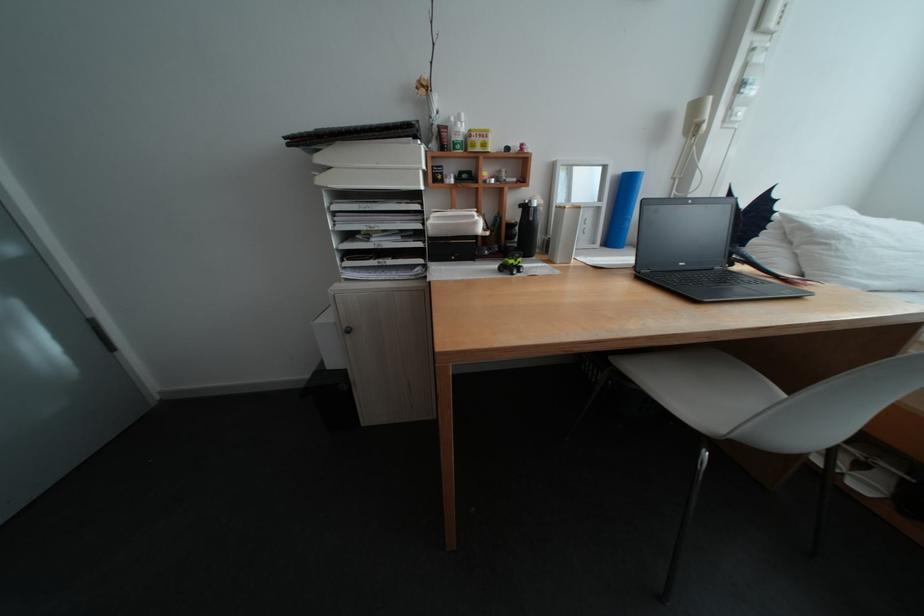
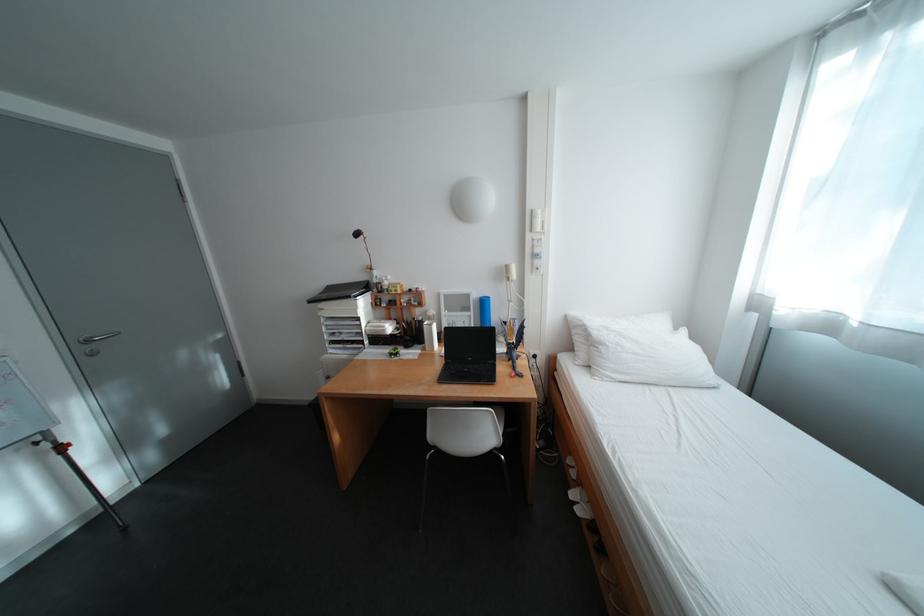
Find the pixel in the second image that matches point (849, 240) in the first image.

(614, 346)